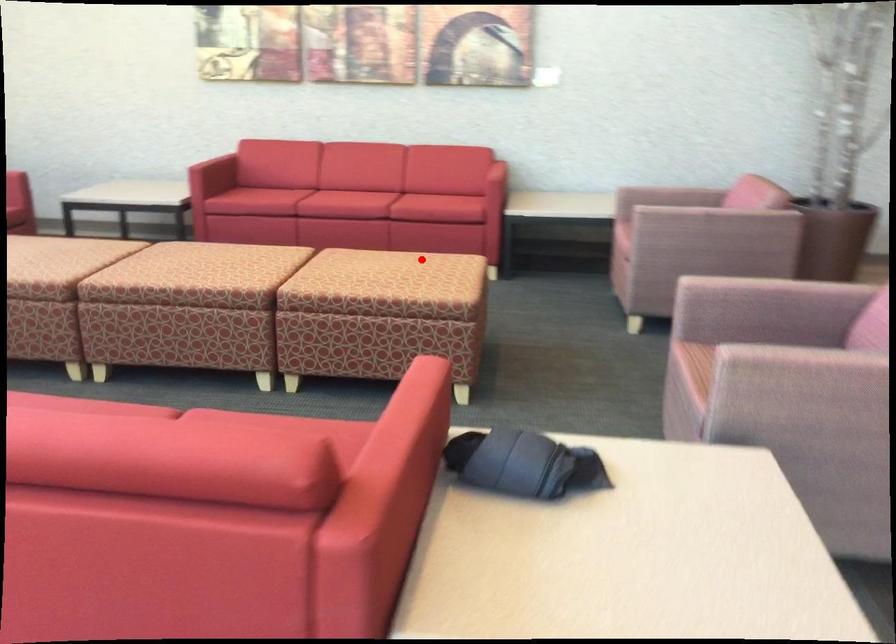
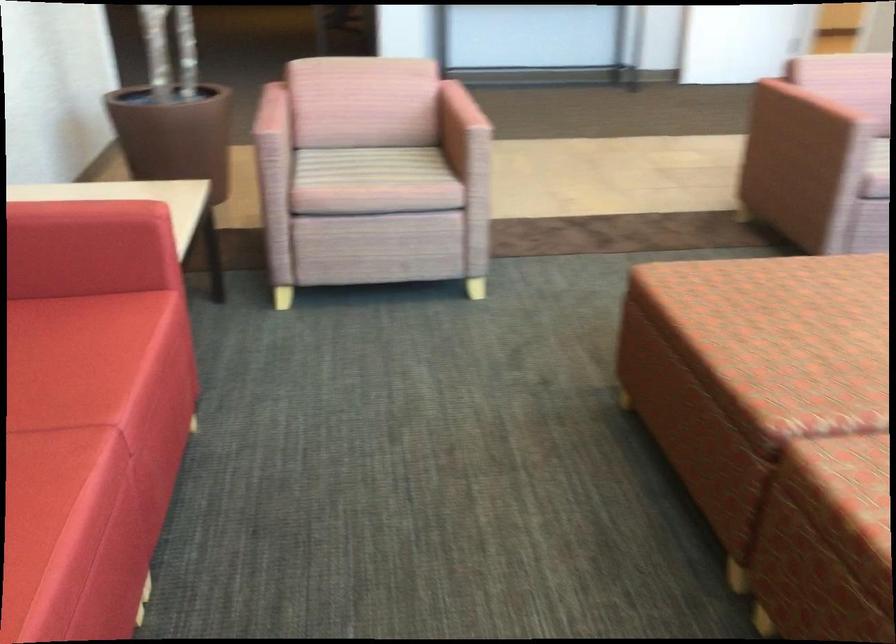
Question: I am providing you with two images of the same scene from different viewpoints. A red point is shown in image1. For the corresponding object point in image2, is it positioned nearer or farther from the camera?

Choices:
 (A) Nearer
 (B) Farther

Answer: (A)